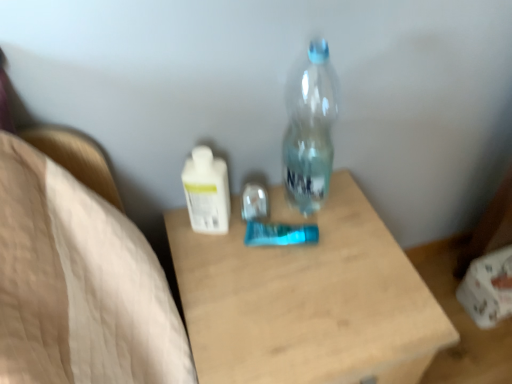
Question: From the image's perspective, is transparent plastic bottle at center, which appears as the 2th bottle when viewed from the left, located beneath wooden table at center?

Choices:
 (A) yes
 (B) no

Answer: (B)

Question: From a real-world perspective, is transparent plastic bottle at center, which appears as the 2th bottle when viewed from the left, physically below wooden table at center?

Choices:
 (A) yes
 (B) no

Answer: (B)

Question: Is transparent plastic bottle at center, which appears as the first bottle when viewed from the right, wider than wooden table at center?

Choices:
 (A) no
 (B) yes

Answer: (A)

Question: Is transparent plastic bottle at center, which appears as the first bottle when viewed from the right, not within wooden table at center?

Choices:
 (A) yes
 (B) no

Answer: (A)

Question: Considering the relative sizes of transparent plastic bottle at center, which appears as the 2th bottle when viewed from the left, and wooden table at center in the image provided, is transparent plastic bottle at center, which appears as the 2th bottle when viewed from the left, thinner than wooden table at center?

Choices:
 (A) yes
 (B) no

Answer: (A)

Question: Is transparent plastic bottle at center, which appears as the first bottle when viewed from the right, taller than wooden table at center?

Choices:
 (A) yes
 (B) no

Answer: (B)

Question: From the image's perspective, is transparent plastic bottle at center, which appears as the first bottle when viewed from the right, located above white glossy lotion at center, the 1th bottle viewed from the left?

Choices:
 (A) yes
 (B) no

Answer: (A)

Question: Considering the relative sizes of transparent plastic bottle at center, which appears as the first bottle when viewed from the right, and white glossy lotion at center, marked as the 2th bottle in a right-to-left arrangement, in the image provided, is transparent plastic bottle at center, which appears as the first bottle when viewed from the right, thinner than white glossy lotion at center, marked as the 2th bottle in a right-to-left arrangement,?

Choices:
 (A) yes
 (B) no

Answer: (B)

Question: Does transparent plastic bottle at center, which appears as the 2th bottle when viewed from the left, appear on the right side of white glossy lotion at center, marked as the 2th bottle in a right-to-left arrangement?

Choices:
 (A) yes
 (B) no

Answer: (A)

Question: Is transparent plastic bottle at center, which appears as the 2th bottle when viewed from the left, in front of white glossy lotion at center, the 1th bottle viewed from the left?

Choices:
 (A) yes
 (B) no

Answer: (A)

Question: Is transparent plastic bottle at center, which appears as the first bottle when viewed from the right, bigger than white glossy lotion at center, the 1th bottle viewed from the left?

Choices:
 (A) no
 (B) yes

Answer: (B)

Question: From the image's perspective, is transparent plastic bottle at center, which appears as the first bottle when viewed from the right, below white glossy lotion at center, the 1th bottle viewed from the left?

Choices:
 (A) yes
 (B) no

Answer: (B)

Question: From the image's perspective, is wooden table at center above white glossy lotion at center, the 1th bottle viewed from the left?

Choices:
 (A) yes
 (B) no

Answer: (B)